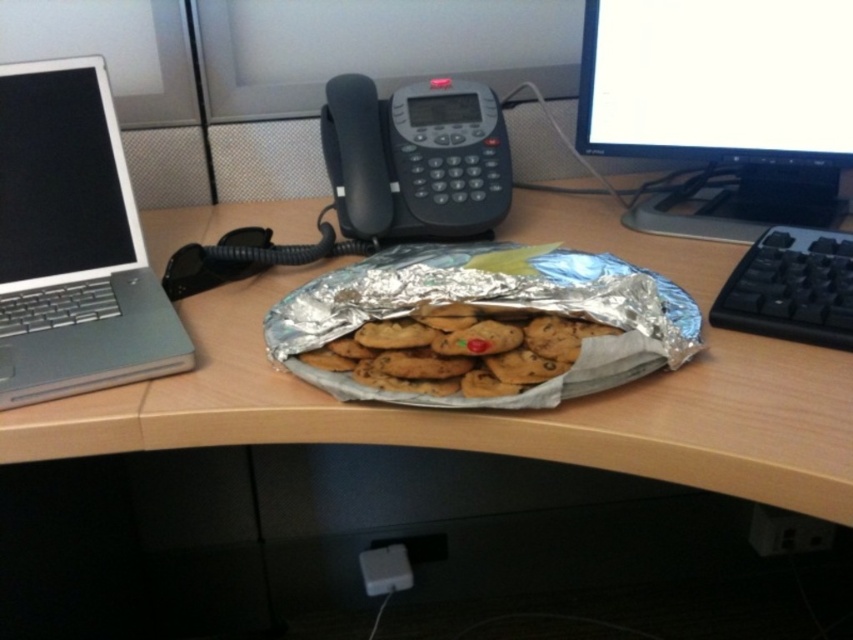
Between point (305, 268) and point (540, 346), which one is positioned in front?

Point (540, 346)

Which of these two, wooden desk at center or golden brown cookie dough at center, stands shorter?

Standing shorter between the two is golden brown cookie dough at center.

Locate an element on the screen. wooden desk at center is located at coordinates (486, 412).

You are a GUI agent. You are given a task and a screenshot of the screen. Output one action in this format:
    pyautogui.click(x=<x>, y=<y>)
    Task: Click on the wooden desk at center
    
    Given the screenshot: What is the action you would take?
    pyautogui.click(x=486, y=412)

Is wooden desk at center positioned before black plastic keyboard at right?

Yes, wooden desk at center is in front of black plastic keyboard at right.

Is point (38, 433) more distant than point (787, 262)?

No, (38, 433) is closer to viewer.

I want to click on wooden desk at center, so click(486, 412).

Does black plastic telephone at center come in front of golden brown cookie dough at center?

No, it is behind golden brown cookie dough at center.

Identify the location of black plastic telephone at center. The height and width of the screenshot is (640, 853). (415, 160).

Who is more distant from viewer, [436,138] or [490,364]?

The point [436,138] is more distant.

This screenshot has height=640, width=853. What are the coordinates of `black plastic telephone at center` in the screenshot? It's located at (415, 160).